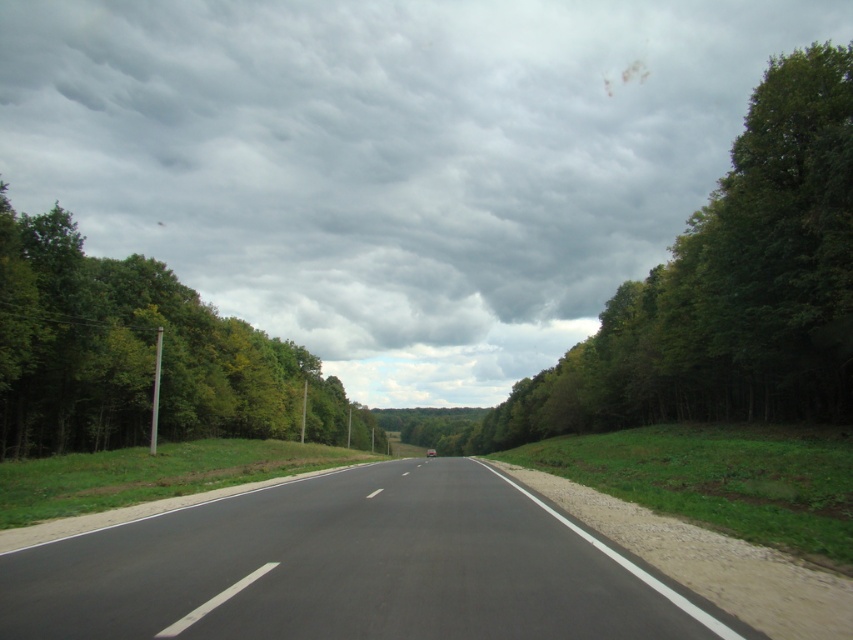
Question: Is cloudy sky at upper center above black asphalt highway at center?

Choices:
 (A) no
 (B) yes

Answer: (B)

Question: Does cloudy sky at upper center appear on the left side of black asphalt highway at center?

Choices:
 (A) no
 (B) yes

Answer: (B)

Question: Which point is farther to the camera?

Choices:
 (A) (619, 340)
 (B) (24, 557)

Answer: (A)

Question: Is black asphalt highway at center smaller than green leafy tree at left?

Choices:
 (A) no
 (B) yes

Answer: (B)

Question: Based on their relative distances, which object is farther from the cloudy sky at upper center?

Choices:
 (A) green leafy tree at left
 (B) black asphalt highway at center

Answer: (B)

Question: Which is farther from the green leafy tree at left?

Choices:
 (A) black asphalt highway at center
 (B) green leafy tree at right
 (C) cloudy sky at upper center

Answer: (C)